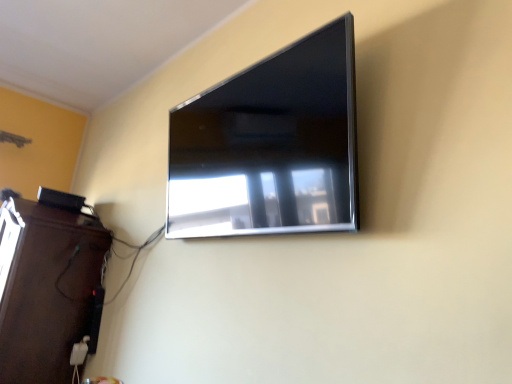
The width and height of the screenshot is (512, 384). Describe the element at coordinates (46, 288) in the screenshot. I see `dark wood entertainment center at lower left` at that location.

This screenshot has width=512, height=384. I want to click on dark wood entertainment center at lower left, so click(x=46, y=288).

Measure the distance between dark wood entertainment center at lower left and camera.

They are 1.80 meters apart.

The width and height of the screenshot is (512, 384). Describe the element at coordinates (270, 145) in the screenshot. I see `satin black tv at upper center` at that location.

Locate an element on the screen. This screenshot has height=384, width=512. satin black tv at upper center is located at coordinates [x=270, y=145].

What is the approximate width of satin black tv at upper center?

3.89 inches.

At what (x,y) coordinates should I click in order to perform the action: click on dark wood entertainment center at lower left. Please return your answer as a coordinate pair (x, y). The height and width of the screenshot is (384, 512). Looking at the image, I should click on (46, 288).

Between dark wood entertainment center at lower left and satin black tv at upper center, which one appears on the left side from the viewer's perspective?

From the viewer's perspective, dark wood entertainment center at lower left appears more on the left side.

Does dark wood entertainment center at lower left come in front of satin black tv at upper center?

No, the depth of dark wood entertainment center at lower left is greater than that of satin black tv at upper center.

Does point (42, 375) lie in front of point (334, 165)?

No, it is behind (334, 165).

From the image's perspective, is dark wood entertainment center at lower left positioned above or below satin black tv at upper center?

Based on their image positions, dark wood entertainment center at lower left is located beneath satin black tv at upper center.

From a real-world perspective, is dark wood entertainment center at lower left under satin black tv at upper center?

Indeed, from a real-world perspective, dark wood entertainment center at lower left is positioned beneath satin black tv at upper center.

Is dark wood entertainment center at lower left wider than satin black tv at upper center?

Correct, the width of dark wood entertainment center at lower left exceeds that of satin black tv at upper center.

Can you confirm if dark wood entertainment center at lower left is taller than satin black tv at upper center?

Yes.

Who is bigger, dark wood entertainment center at lower left or satin black tv at upper center?

With larger size is dark wood entertainment center at lower left.

Is dark wood entertainment center at lower left not within satin black tv at upper center?

Yes, dark wood entertainment center at lower left is not within satin black tv at upper center.

Can you see dark wood entertainment center at lower left touching satin black tv at upper center?

There is a gap between dark wood entertainment center at lower left and satin black tv at upper center.

Is dark wood entertainment center at lower left looking in the opposite direction of satin black tv at upper center?

No, dark wood entertainment center at lower left is not facing away from satin black tv at upper center.

How much distance is there between dark wood entertainment center at lower left and satin black tv at upper center?

dark wood entertainment center at lower left and satin black tv at upper center are 3.37 feet apart.

Find the location of a particular element. Image resolution: width=512 pixels, height=384 pixels. television in front of the dark wood entertainment center at lower left is located at coordinates (270, 145).

Is satin black tv at upper center to the right of dark wood entertainment center at lower left from the viewer's perspective?

Yes.

Which object is closer to the camera, satin black tv at upper center or dark wood entertainment center at lower left?

satin black tv at upper center is more forward.

Is point (295, 110) behind point (23, 270)?

No, it is not.

From the image's perspective, between satin black tv at upper center and dark wood entertainment center at lower left, which one is located above?

satin black tv at upper center.

From a real-world perspective, is satin black tv at upper center on dark wood entertainment center at lower left?

Indeed, from a real-world perspective, satin black tv at upper center stands above dark wood entertainment center at lower left.

Looking at their sizes, would you say satin black tv at upper center is wider or thinner than dark wood entertainment center at lower left?

Considering their sizes, satin black tv at upper center looks slimmer than dark wood entertainment center at lower left.

From the picture: From their relative heights in the image, would you say satin black tv at upper center is taller or shorter than dark wood entertainment center at lower left?

satin black tv at upper center is shorter than dark wood entertainment center at lower left.

Is satin black tv at upper center smaller than dark wood entertainment center at lower left?

Correct, satin black tv at upper center occupies less space than dark wood entertainment center at lower left.

Looking at this image, is satin black tv at upper center surrounding dark wood entertainment center at lower left?

No, dark wood entertainment center at lower left is not surrounded by satin black tv at upper center.

Is satin black tv at upper center next to dark wood entertainment center at lower left and touching it?

No, satin black tv at upper center is not beside dark wood entertainment center at lower left.

Does satin black tv at upper center turn towards dark wood entertainment center at lower left?

No, satin black tv at upper center is not oriented towards dark wood entertainment center at lower left.

Image resolution: width=512 pixels, height=384 pixels. In order to click on furniture beneath the satin black tv at upper center (from a real-world perspective) in this screenshot , I will do `click(46, 288)`.

At what (x,y) coordinates should I click in order to perform the action: click on television above the dark wood entertainment center at lower left (from the image's perspective). Please return your answer as a coordinate pair (x, y). This screenshot has height=384, width=512. Looking at the image, I should click on (270, 145).

This screenshot has width=512, height=384. Identify the location of television located on the right of dark wood entertainment center at lower left. (270, 145).